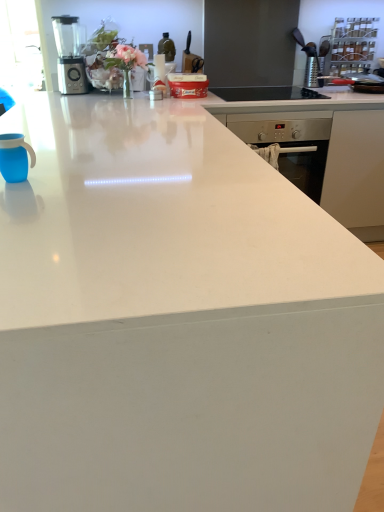
Question: Are blue matte mug at left and metallic silver blender at upper left beside each other?

Choices:
 (A) yes
 (B) no

Answer: (B)

Question: Is blue matte mug at left at the right side of metallic silver blender at upper left?

Choices:
 (A) no
 (B) yes

Answer: (B)

Question: Can you confirm if blue matte mug at left is thinner than metallic silver blender at upper left?

Choices:
 (A) no
 (B) yes

Answer: (B)

Question: Is blue matte mug at left oriented towards metallic silver blender at upper left?

Choices:
 (A) yes
 (B) no

Answer: (B)

Question: Is metallic silver blender at upper left completely or partially inside blue matte mug at left?

Choices:
 (A) yes
 (B) no

Answer: (B)

Question: In terms of height, does blue matte mug at left look taller or shorter compared to black glass gas stove at upper center?

Choices:
 (A) short
 (B) tall

Answer: (B)

Question: In terms of width, does blue matte mug at left look wider or thinner when compared to black glass gas stove at upper center?

Choices:
 (A) wide
 (B) thin

Answer: (B)

Question: From the image's perspective, is blue matte mug at left located above or below black glass gas stove at upper center?

Choices:
 (A) above
 (B) below

Answer: (B)

Question: In the image, is blue matte mug at left positioned in front of or behind black glass gas stove at upper center?

Choices:
 (A) front
 (B) behind

Answer: (A)

Question: Relative to blue matte mug at left, is black glass gas stove at upper center in front or behind?

Choices:
 (A) front
 (B) behind

Answer: (B)

Question: Choose the correct answer: Is black glass gas stove at upper center inside blue matte mug at left or outside it?

Choices:
 (A) inside
 (B) outside

Answer: (B)

Question: From their relative heights in the image, would you say black glass gas stove at upper center is taller or shorter than blue matte mug at left?

Choices:
 (A) short
 (B) tall

Answer: (A)

Question: Considering the positions of point (258, 89) and point (4, 174), is point (258, 89) closer or farther from the camera than point (4, 174)?

Choices:
 (A) closer
 (B) farther

Answer: (B)

Question: In terms of size, does black glass gas stove at upper center appear bigger or smaller than metallic silver blender at upper left?

Choices:
 (A) small
 (B) big

Answer: (B)

Question: From the image's perspective, relative to metallic silver blender at upper left, is black glass gas stove at upper center above or below?

Choices:
 (A) above
 (B) below

Answer: (B)